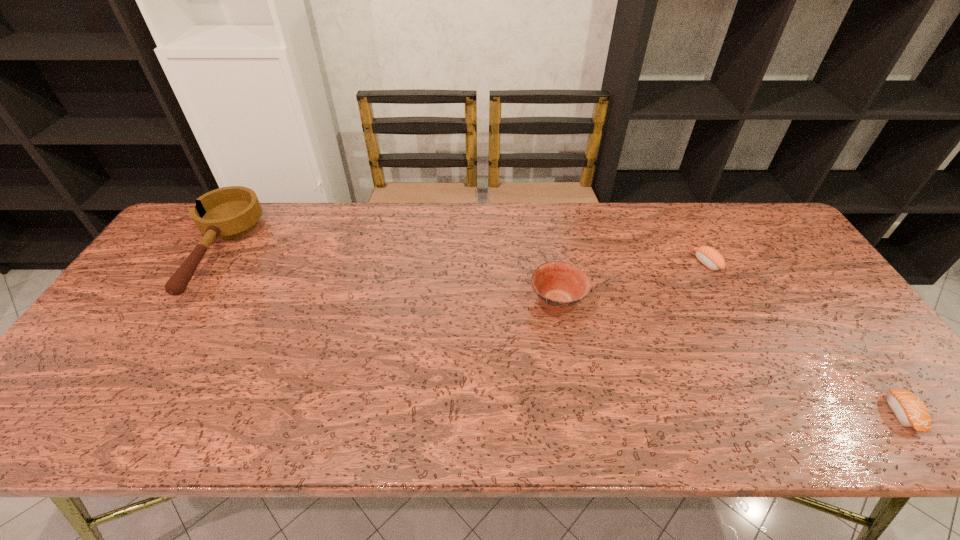
Find the location of a particular element. The height and width of the screenshot is (540, 960). vacant space that is in between the right sushi and the second object from left to right is located at coordinates (730, 357).

Point out which object is positioned as the second nearest to the bowl. Please provide its 2D coordinates. Your answer should be formatted as a tuple, i.e. [(x, y)], where the tuple contains the x and y coordinates of a point satisfying the conditions above.

[(909, 409)]

Identify which object is the second nearest to the leftmost object. Please provide its 2D coordinates. Your answer should be formatted as a tuple, i.e. [(x, y)], where the tuple contains the x and y coordinates of a point satisfying the conditions above.

[(708, 256)]

Identify the location of vacant space that satisfies the following two spatial constraints: 1. on the front side of the nearer sushi; 2. on the right side of the third object from right to left. The height and width of the screenshot is (540, 960). pyautogui.click(x=576, y=413).

You are a GUI agent. You are given a task and a screenshot of the screen. Output one action in this format:
    pyautogui.click(x=<x>, y=<y>)
    Task: Click on the free space in the image that satisfies the following two spatial constraints: 1. with the handle on the side of the leftmost object; 2. on the left side of the right sushi
    
    Given the screenshot: What is the action you would take?
    point(117,413)

Identify the location of free region that satisfies the following two spatial constraints: 1. on the back side of the third object from right to left; 2. on the right side of the taller sushi. (551, 263).

The width and height of the screenshot is (960, 540). I want to click on free spot that satisfies the following two spatial constraints: 1. with the handle on the side of the shorter sushi; 2. on the right side of the leftmost object, so click(117, 413).